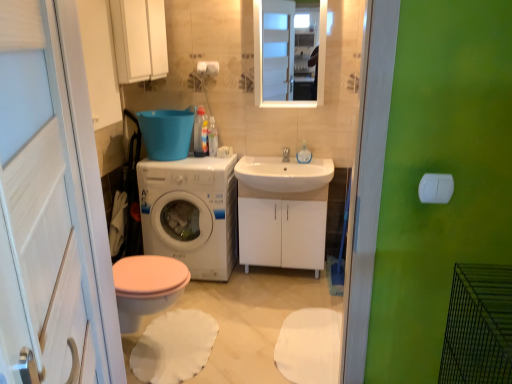
Describe the element at coordinates (167, 133) in the screenshot. The width and height of the screenshot is (512, 384). I see `teal plastic bucket at center` at that location.

In order to face teal plastic bucket at center, should I rotate leftwards or rightwards?

Rotate left and turn 11.872 degrees.

The height and width of the screenshot is (384, 512). I want to click on white glossy sink at center, so click(286, 154).

This screenshot has height=384, width=512. What do you see at coordinates (212, 137) in the screenshot?
I see `translucent plastic bottle at center` at bounding box center [212, 137].

Locate an element on the screen. Image resolution: width=512 pixels, height=384 pixels. white matte toilet paper at center is located at coordinates (208, 68).

What do you see at coordinates (282, 228) in the screenshot? The width and height of the screenshot is (512, 384). I see `white glossy cabinet at center` at bounding box center [282, 228].

Image resolution: width=512 pixels, height=384 pixels. Identify the location of white glossy medicine cabinet at upper center. (139, 39).

The height and width of the screenshot is (384, 512). Describe the element at coordinates (139, 39) in the screenshot. I see `white glossy medicine cabinet at upper center` at that location.

Where is `white glossy sink at center`? The width and height of the screenshot is (512, 384). white glossy sink at center is located at coordinates (283, 174).

Consider the image. Between white matte toilet paper at center and white glossy cabinet at upper center, which one appears on the right side from the viewer's perspective?

A: From the viewer's perspective, white glossy cabinet at upper center appears more on the right side.

How different are the orientations of white matte toilet paper at center and white glossy cabinet at upper center in degrees?

white matte toilet paper at center and white glossy cabinet at upper center are facing 0.833 degrees away from each other.

Is white matte toilet paper at center turned away from white glossy cabinet at upper center?

No, white glossy cabinet at upper center is not at the back of white matte toilet paper at center.

Which point is more forward, (216, 147) or (319, 33)?

The point (319, 33) is more forward.

Can you see translucent plastic bottle at center touching white glossy cabinet at upper center?

They are not placed beside each other.

Who is shorter, translucent plastic bottle at center or white glossy cabinet at upper center?

With less height is translucent plastic bottle at center.

Can you confirm if white glossy screen door at left is shorter than translucent plastic bottle at center?

No.

In the image, is white glossy screen door at left positioned in front of or behind translucent plastic bottle at center?

white glossy screen door at left is positioned closer to the viewer than translucent plastic bottle at center.

Is white glossy screen door at left positioned before white glossy cabinet at center?

Yes, white glossy screen door at left is closer to the viewer.

From the image's perspective, is white glossy screen door at left on white glossy cabinet at center?

Incorrect, from the image's perspective, white glossy screen door at left is lower than white glossy cabinet at center.

Is white glossy cabinet at center completely or partially inside white glossy screen door at left?

No, white glossy cabinet at center is not surrounded by white glossy screen door at left.

Which of these two, white glossy sink at center or white glossy washing machine at center, is bigger?

Bigger between the two is white glossy washing machine at center.

Is white glossy sink at center looking in the opposite direction of white glossy washing machine at center?

No, white glossy sink at center is not facing the opposite direction of white glossy washing machine at center.

Is white glossy sink at center inside the boundaries of white glossy washing machine at center, or outside?

white glossy sink at center cannot be found inside white glossy washing machine at center.

Where is `tap located behind the white glossy washing machine at center`? Image resolution: width=512 pixels, height=384 pixels. tap located behind the white glossy washing machine at center is located at coordinates (286, 154).

From the picture: Which is more to the left, white glossy sink at center or translucent plastic bottle at center?

From the viewer's perspective, translucent plastic bottle at center appears more on the left side.

Which is behind, white glossy sink at center or translucent plastic bottle at center?

translucent plastic bottle at center.

Is white glossy sink at center completely or partially outside of translucent plastic bottle at center?

Yes.

Which object is further away from the camera taking this photo, white glossy cabinet at center or white matte toilet paper at center?

white matte toilet paper at center.

Which of these two, white glossy cabinet at center or white matte toilet paper at center, stands taller?

With more height is white glossy cabinet at center.

Does white glossy cabinet at center have a greater width compared to white matte toilet paper at center?

Yes.

At what (x,y) coordinates should I click in order to perform the action: click on mirror on the right of white matte toilet paper at center. Please return your answer as a coordinate pair (x, y). The height and width of the screenshot is (384, 512). Looking at the image, I should click on (262, 59).

In order to click on toiletry that is behind the white glossy cabinet at upper center in this screenshot , I will do `click(212, 137)`.

Based on their spatial positions, is white glossy screen door at left or teal plastic bucket at center further from white glossy sink at center?

Based on the image, white glossy screen door at left appears to be further to white glossy sink at center.

Based on their spatial positions, is white glossy screen door at left or white glossy sink at center closer to white glossy sink at center?

The object closer to white glossy sink at center is white glossy sink at center.

Estimate the real-world distances between objects in this image. Which object is further from white matte toilet paper at center, teal plastic bucket at center or white glossy medicine cabinet at upper center?

Among the two, white glossy medicine cabinet at upper center is located further to white matte toilet paper at center.

Based on their spatial positions, is white matte toilet paper at center or translucent plastic bottle at center further from white glossy sink at center?

white matte toilet paper at center is further to white glossy sink at center.

In the scene shown: Estimate the real-world distances between objects in this image. Which object is further from white glossy sink at center, white glossy cabinet at upper center or translucent plastic bottle at center?

translucent plastic bottle at center lies further to white glossy sink at center than the other object.

When comparing their distances from white matte toilet paper at center, does white glossy sink at center or white glossy screen door at left seem further?

The object further to white matte toilet paper at center is white glossy screen door at left.

Based on their spatial positions, is white glossy screen door at left or white glossy sink at center closer to teal plastic bucket at center?

Based on the image, white glossy sink at center appears to be nearer to teal plastic bucket at center.

When comparing their distances from white glossy washing machine at center, does white glossy screen door at left or white glossy medicine cabinet at upper center seem closer?

Among the two, white glossy medicine cabinet at upper center is located nearer to white glossy washing machine at center.

This screenshot has width=512, height=384. I want to click on toilet paper between teal plastic bucket at center and white glossy sink at center from left to right, so click(208, 68).

Identify the location of sink between white glossy screen door at left and white matte toilet paper at center in the front-back direction. The width and height of the screenshot is (512, 384). (283, 174).

Image resolution: width=512 pixels, height=384 pixels. What are the coordinates of `mirror between white glossy medicine cabinet at upper center and white glossy cabinet at center from top to bottom` in the screenshot? It's located at (262, 59).

The width and height of the screenshot is (512, 384). In order to click on toiletry situated between teal plastic bucket at center and white glossy cabinet at upper center from left to right in this screenshot , I will do `click(212, 137)`.